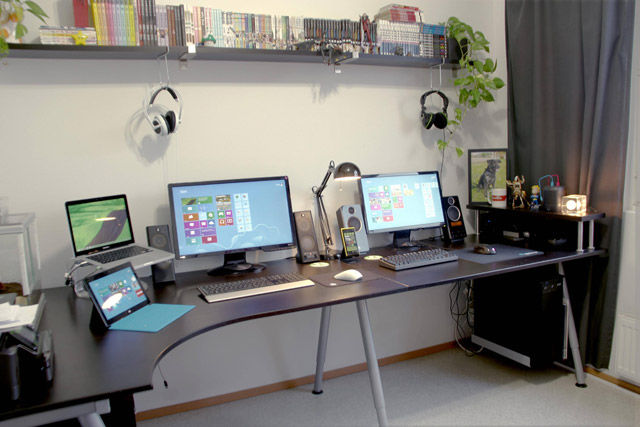
The height and width of the screenshot is (427, 640). I want to click on keyboard, so click(246, 287), click(416, 256), click(144, 317).